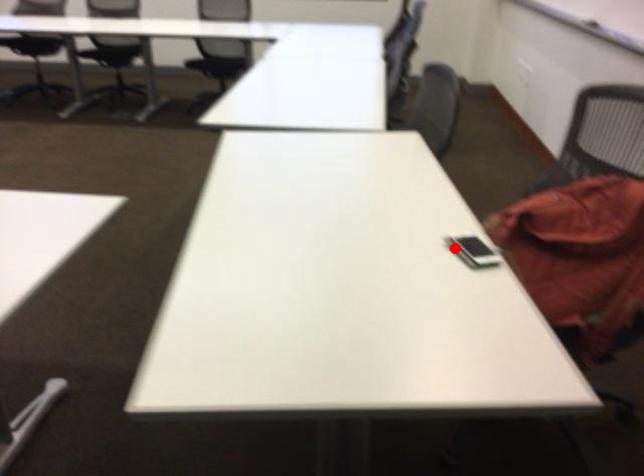
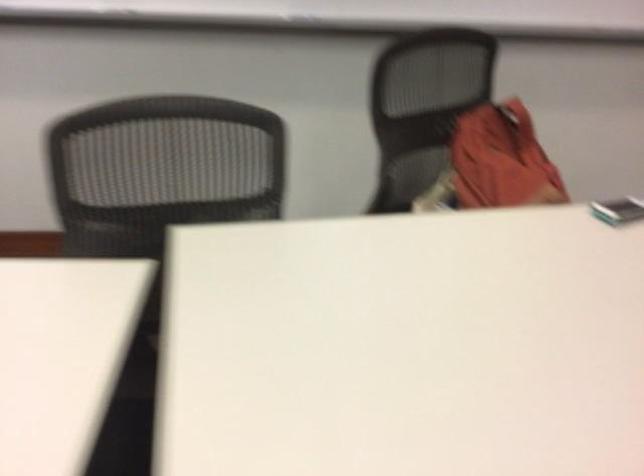
Find the pixel in the second image that matches the highlighted location in the first image.

(618, 210)